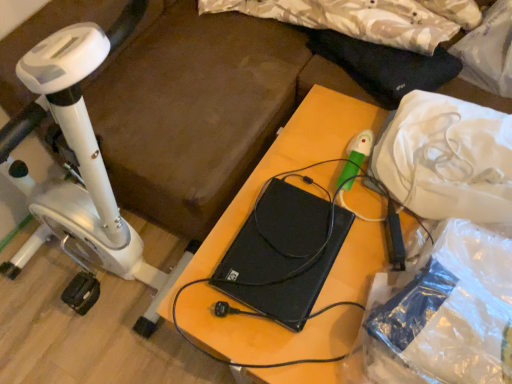
You are a GUI agent. You are given a task and a screenshot of the screen. Output one action in this format:
    pyautogui.click(x=<x>, y=<y>)
    Task: Click on the vacant space to the right of black matte laptop at center
    The image size is (512, 384).
    Given the screenshot: What is the action you would take?
    pyautogui.click(x=370, y=244)